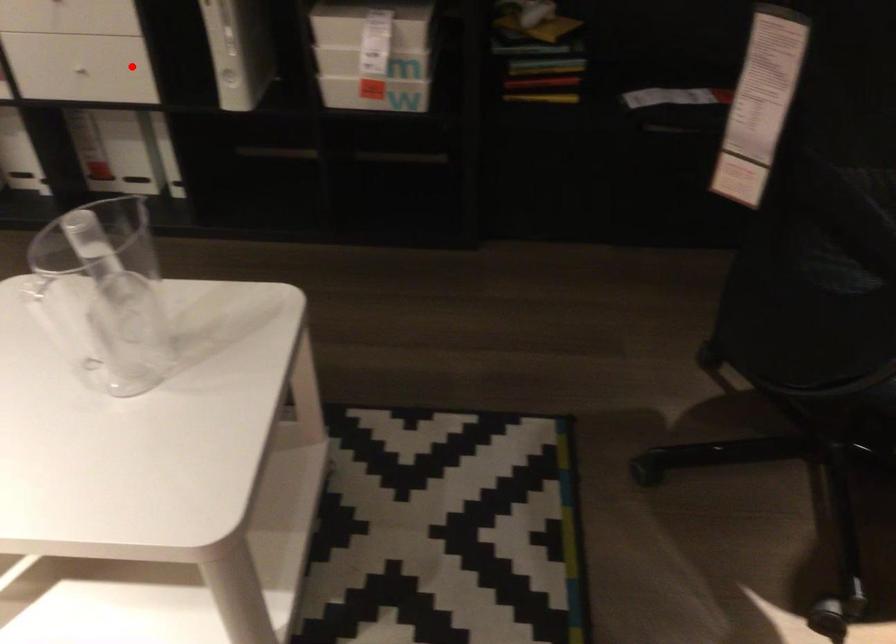
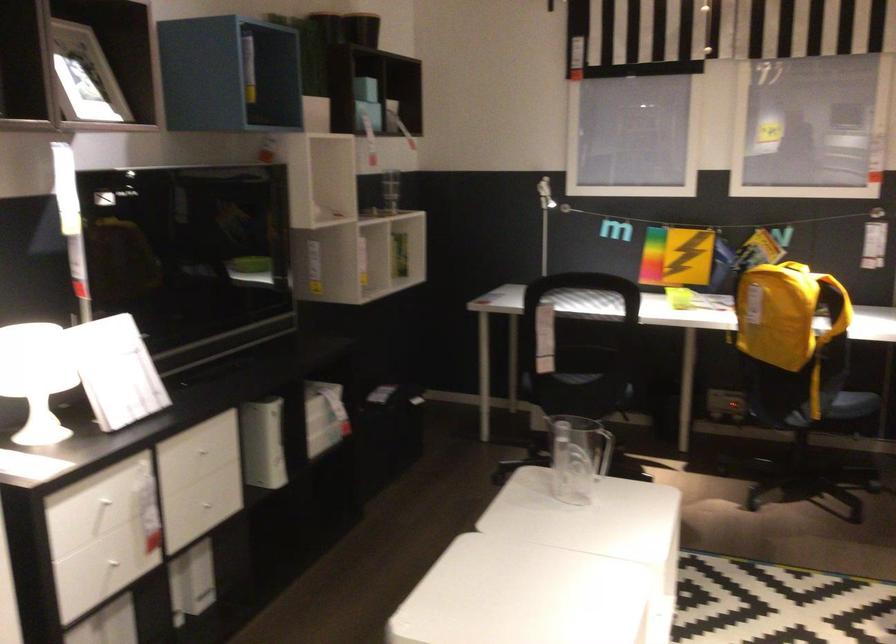
Question: I am providing you with two images of the same scene from different viewpoints. Image1 has a red point marked. In image2, the corresponding 3D location appears at what relative position? Reply with the corresponding letter.

Choices:
 (A) Closer
 (B) Farther

Answer: (B)